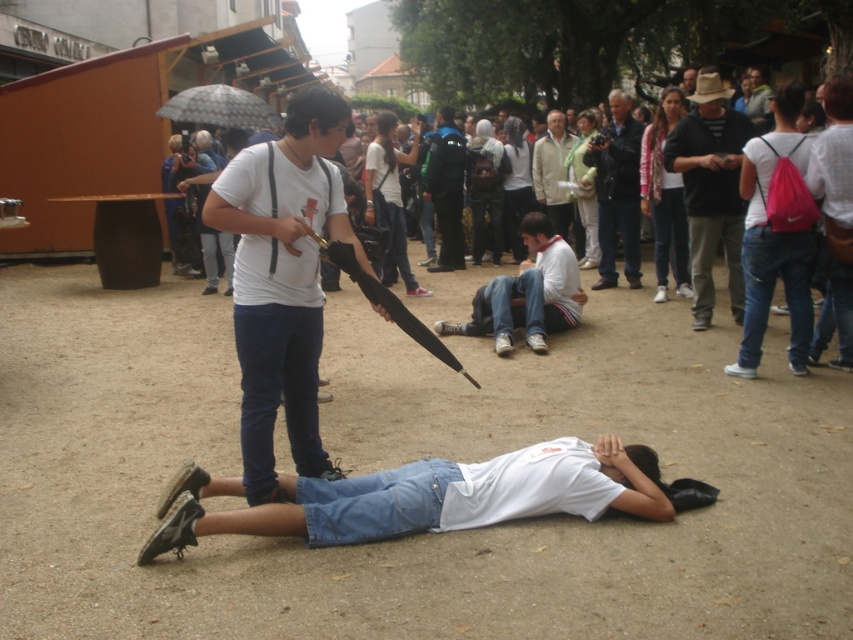
Who is more forward, (718, 225) or (619, 144)?

Point (718, 225) is more forward.

Describe the element at coordinates (711, 189) in the screenshot. Image resolution: width=853 pixels, height=640 pixels. I see `black textured shirt at upper right` at that location.

What do you see at coordinates (711, 189) in the screenshot?
I see `black textured shirt at upper right` at bounding box center [711, 189].

At what (x,y) coordinates should I click in order to perform the action: click on black textured shirt at upper right. Please return your answer as a coordinate pair (x, y). The height and width of the screenshot is (640, 853). Looking at the image, I should click on (711, 189).

Which is more to the left, white matte shirt at center or black textured shirt at upper right?

white matte shirt at center is more to the left.

Is white matte shirt at center taller than black textured shirt at upper right?

No, white matte shirt at center is not taller than black textured shirt at upper right.

Image resolution: width=853 pixels, height=640 pixels. What do you see at coordinates (282, 280) in the screenshot? I see `white matte shirt at center` at bounding box center [282, 280].

Identify the location of white matte shirt at center. (282, 280).

Measure the distance from white matte shirt at center to light beige jacket at center.

white matte shirt at center and light beige jacket at center are 7.79 meters apart.

Between white matte shirt at center and light beige jacket at center, which one appears on the left side from the viewer's perspective?

white matte shirt at center

Locate an element on the screen. The width and height of the screenshot is (853, 640). white matte shirt at center is located at coordinates (282, 280).